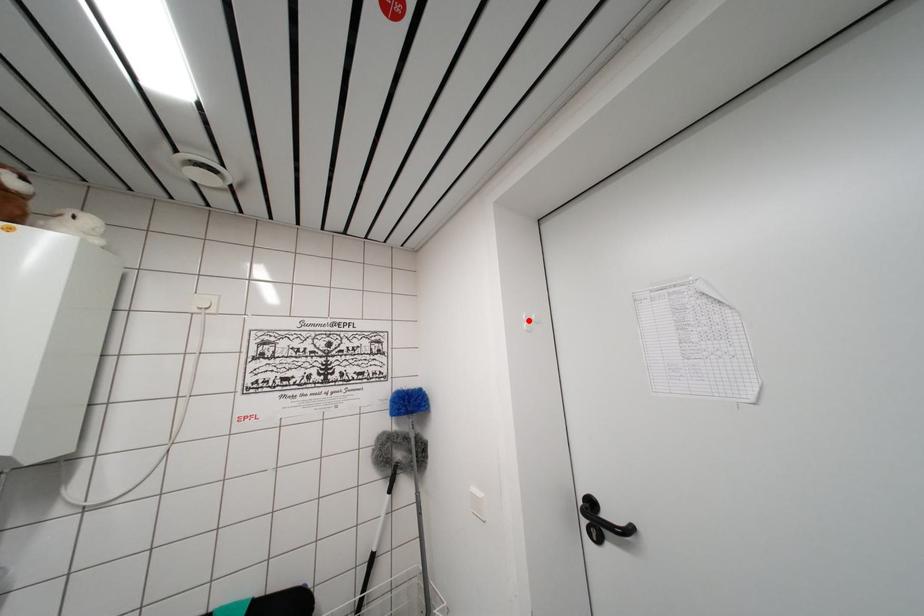
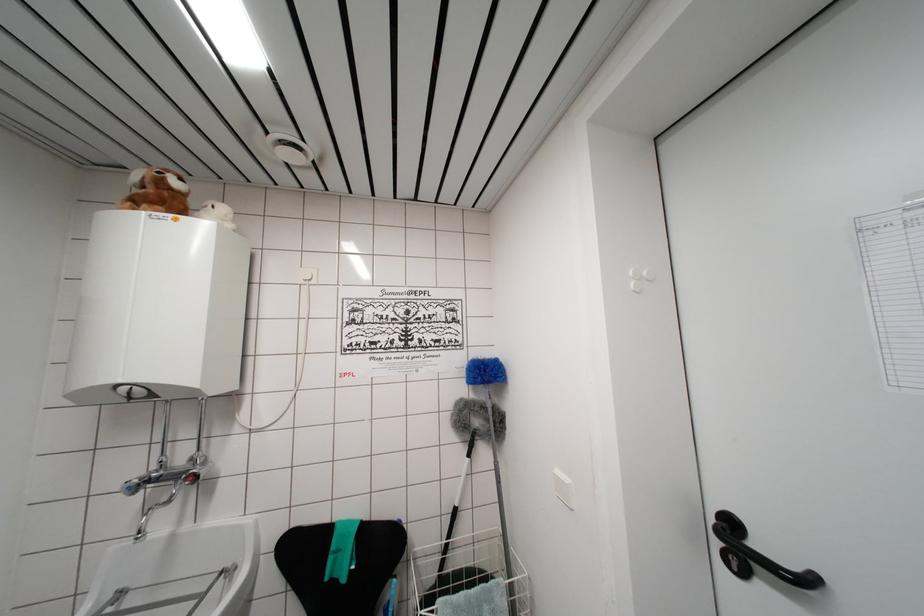
Locate, in the second image, the point that corresponds to the highlighted location in the first image.

(637, 276)